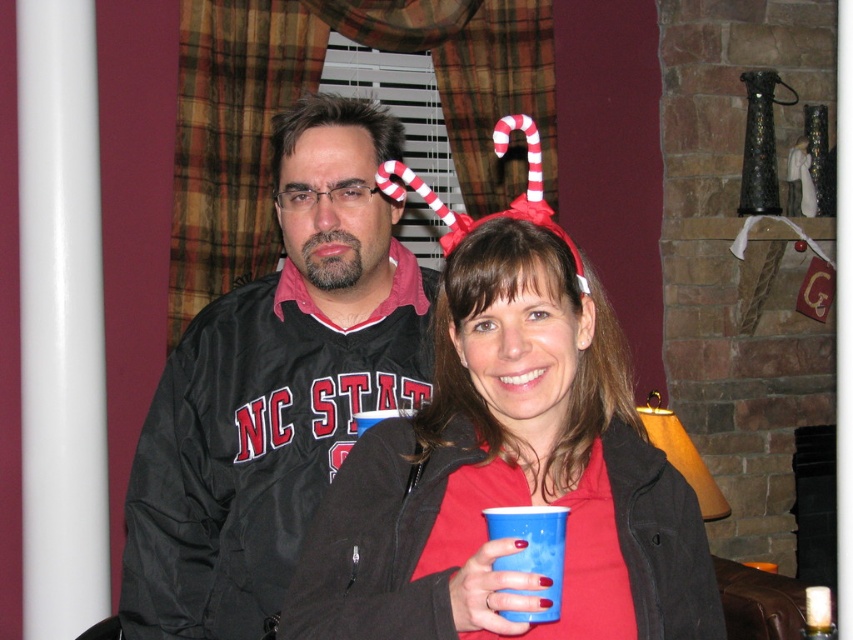
You are at a party and need to decide which item to take for a game. The game requires an object that can hold liquid. Which one would you choose between the matte plastic cup at center and the white striped fabric candy cane at upper center?

The matte plastic cup at center is larger in size compared to the white striped fabric candy cane at upper center, making it more suitable for holding liquid.

You are standing in the room and want to reach both points. Which point, point (x=531, y=520) or point (x=534, y=154), is closer to you?

Point (x=531, y=520) is closer to the viewer than point (x=534, y=154).

You are at a holiday party and need to place a gift under the white striped fabric candy cane at upper center. The gift is taller than the matte plastic cup at center. Where should you place it?

Since the matte plastic cup at center is below the white striped fabric candy cane at upper center and the gift is taller than the matte plastic cup at center, you should place the gift below the white striped fabric candy cane at upper center where there is enough space.